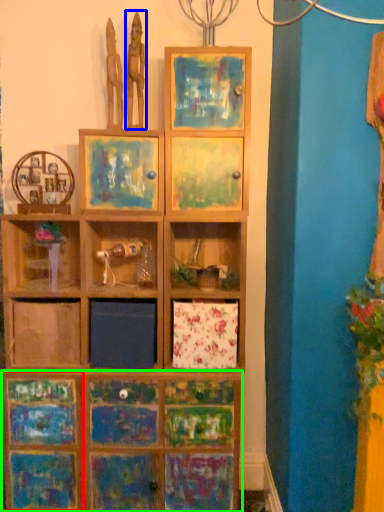
Question: Which object is positioned closest to cabinetry (highlighted by a red box)? Select from sculpture (highlighted by a blue box) and cabinetry (highlighted by a green box).

Choices:
 (A) sculpture
 (B) cabinetry

Answer: (B)